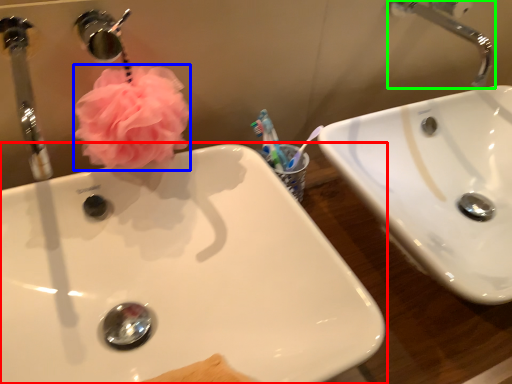
Question: Which is nearer to the sink (highlighted by a red box)? flower (highlighted by a blue box) or tap (highlighted by a green box).

Choices:
 (A) flower
 (B) tap

Answer: (A)